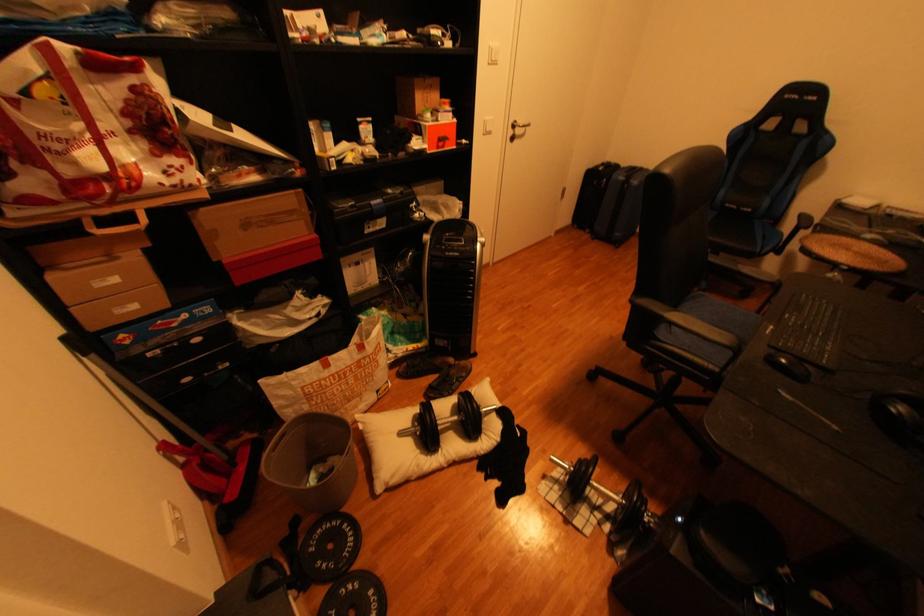
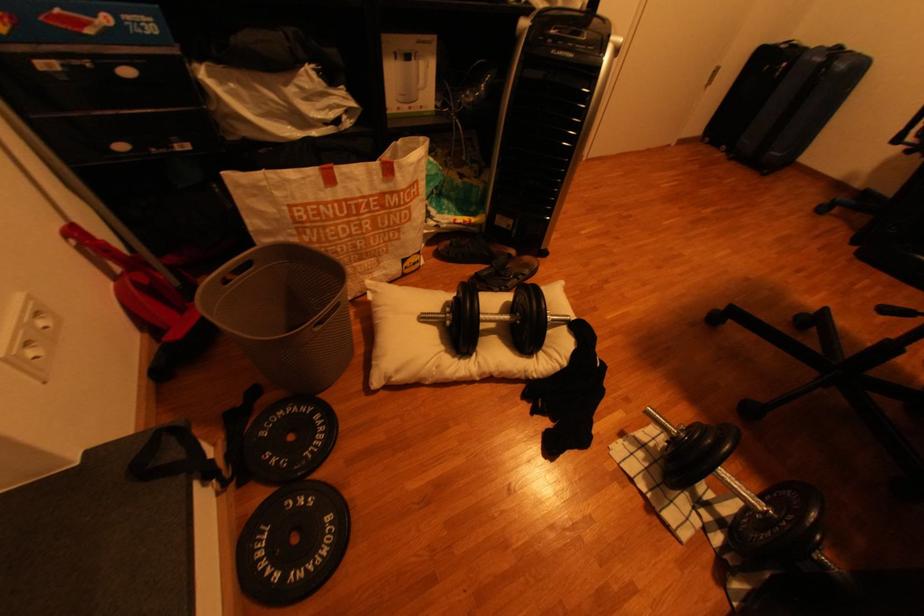
Find the pixel in the second image that matches (x=574, y=480) in the first image.

(665, 446)